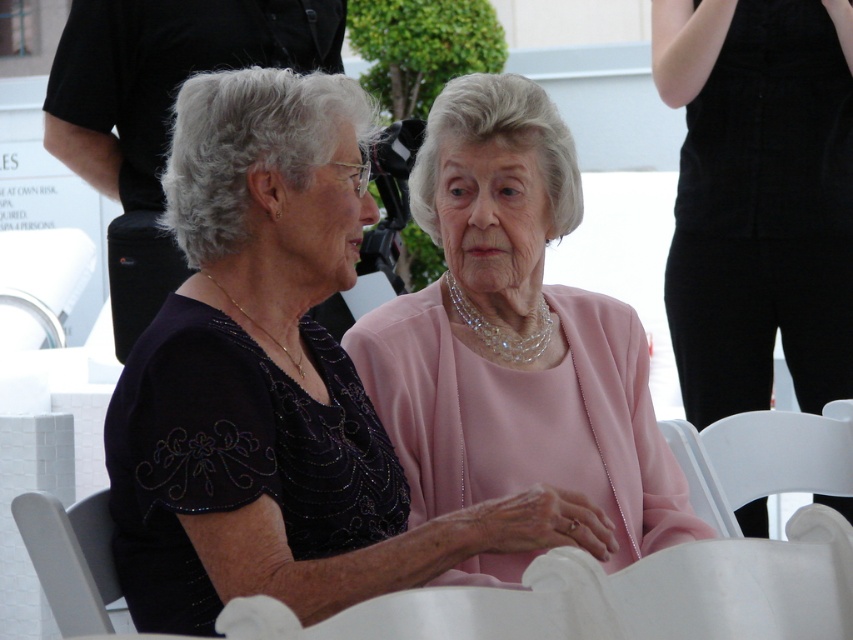
From the picture: You are a photographer at an event and need to ensure that the pink satin dress at center and the white plastic chair at lower left are both visible in your photo. Given their height difference, which object will appear larger in the photo?

The pink satin dress at center will appear larger in the photo because it is much taller than the white plastic chair at lower left.

You are a photographer at an event and need to position a large camera between the pink satin dress at center and the white plastic chair at lower left. Can the camera fit between them if it requires 1.2 meters of space?

The pink satin dress at center is bigger than the white plastic chair at lower left, but the exact distance between them isn generated in the Objects Description. Without knowing the actual spacing, we cannot confirm if the camera will fit.

You are a photographer at an event and need to adjust the lighting to highlight both the black satin dress at center and the white plastic chair at lower right. Which object is located to the right of the other?

The black satin dress at center is positioned on the right side of white plastic chair at lower right, so it is to the right of the chair.